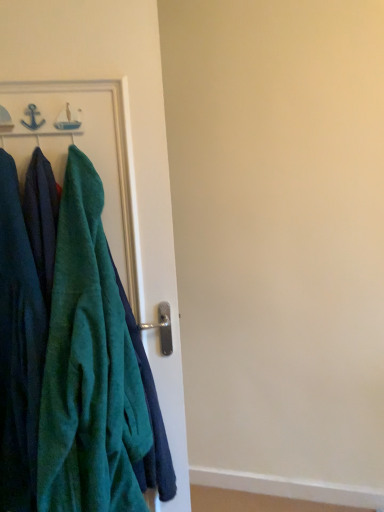
Question: Visually, is velvety green towel at left positioned to the left or to the right of velvety green robe at left?

Choices:
 (A) left
 (B) right

Answer: (B)

Question: Considering the positions of velvety green towel at left and velvety green robe at left in the image, is velvety green towel at left wider or thinner than velvety green robe at left?

Choices:
 (A) wide
 (B) thin

Answer: (A)

Question: Considering their positions, is velvety green towel at left located in front of or behind velvety green robe at left?

Choices:
 (A) front
 (B) behind

Answer: (A)

Question: From the image's perspective, is velvety green robe at left located above or below velvety green towel at left?

Choices:
 (A) above
 (B) below

Answer: (A)

Question: From a real-world perspective, is velvety green robe at left positioned above or below velvety green towel at left?

Choices:
 (A) above
 (B) below

Answer: (A)

Question: Is velvety green robe at left inside the boundaries of velvety green towel at left, or outside?

Choices:
 (A) outside
 (B) inside

Answer: (A)

Question: Looking at the image, does velvety green robe at left seem bigger or smaller compared to velvety green towel at left?

Choices:
 (A) big
 (B) small

Answer: (B)